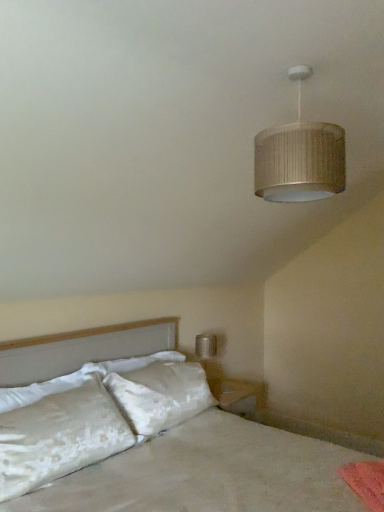
Question: Is white velvety pillow at lower left, positioned as the second pillow in top-to-bottom order, positioned beyond the bounds of white soft pillow at left, the second pillow in the bottom-to-top sequence?

Choices:
 (A) no
 (B) yes

Answer: (B)

Question: Considering the relative sizes of white velvety pillow at lower left, positioned as the second pillow in top-to-bottom order, and white soft pillow at left, the first pillow when ordered from top to bottom, in the image provided, is white velvety pillow at lower left, positioned as the second pillow in top-to-bottom order, bigger than white soft pillow at left, the first pillow when ordered from top to bottom,?

Choices:
 (A) yes
 (B) no

Answer: (A)

Question: Is white velvety pillow at lower left, positioned as the second pillow in top-to-bottom order, aimed at white soft pillow at left, the second pillow in the bottom-to-top sequence?

Choices:
 (A) no
 (B) yes

Answer: (B)

Question: From a real-world perspective, is white velvety pillow at lower left, positioned as the second pillow in top-to-bottom order, under white soft pillow at left, the second pillow in the bottom-to-top sequence?

Choices:
 (A) yes
 (B) no

Answer: (A)

Question: Can you confirm if white velvety pillow at lower left, positioned as the second pillow in top-to-bottom order, is positioned to the left of white soft pillow at left, the first pillow when ordered from top to bottom?

Choices:
 (A) yes
 (B) no

Answer: (B)

Question: Is white satin bed at lower left wider or thinner than matte silver lampshade at upper right?

Choices:
 (A) wide
 (B) thin

Answer: (A)

Question: Is white satin bed at lower left bigger or smaller than matte silver lampshade at upper right?

Choices:
 (A) small
 (B) big

Answer: (B)

Question: From the image's perspective, is white satin bed at lower left positioned above or below matte silver lampshade at upper right?

Choices:
 (A) below
 (B) above

Answer: (A)

Question: Is point (198, 422) closer or farther from the camera than point (322, 189)?

Choices:
 (A) closer
 (B) farther

Answer: (B)

Question: Is white soft pillow at left, the second pillow in the bottom-to-top sequence, in front of or behind white satin bed at lower left in the image?

Choices:
 (A) behind
 (B) front

Answer: (A)

Question: Based on their sizes in the image, would you say white soft pillow at left, the second pillow in the bottom-to-top sequence, is bigger or smaller than white satin bed at lower left?

Choices:
 (A) big
 (B) small

Answer: (B)

Question: Is white soft pillow at left, the first pillow when ordered from top to bottom, situated inside white satin bed at lower left or outside?

Choices:
 (A) outside
 (B) inside

Answer: (B)

Question: Does point (54, 378) appear closer or farther from the camera than point (281, 476)?

Choices:
 (A) closer
 (B) farther

Answer: (B)

Question: From a real-world perspective, relative to white soft pillow at left, the first pillow when ordered from top to bottom, is matte silver lampshade at upper right vertically above or below?

Choices:
 (A) above
 (B) below

Answer: (A)

Question: Is point (294, 74) positioned closer to the camera than point (46, 394)?

Choices:
 (A) closer
 (B) farther

Answer: (A)